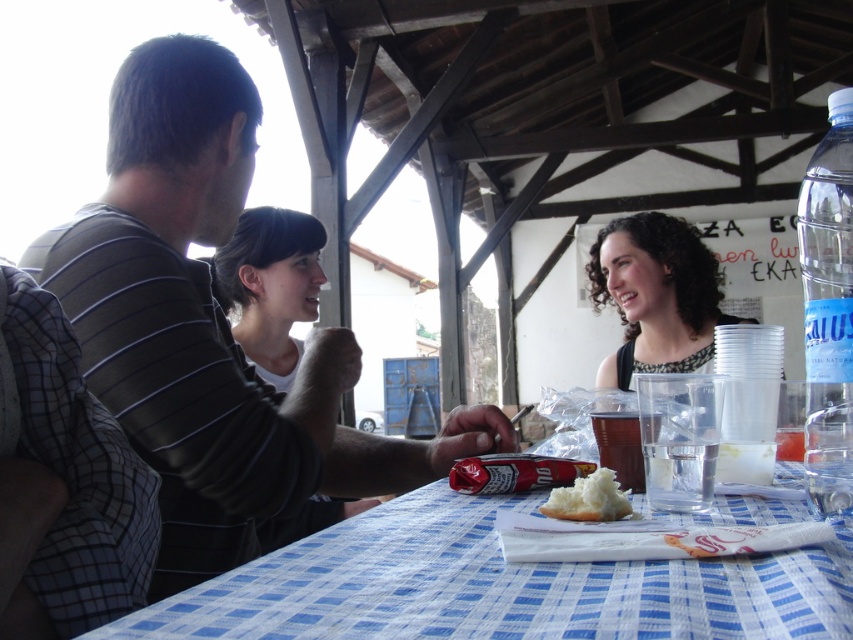
Between point (227, 259) and point (674, 465), which one is positioned in front?

Positioned in front is point (674, 465).

Which is behind, point (257, 349) or point (675, 468)?

Positioned behind is point (257, 349).

Where is `matte black hair at center`? matte black hair at center is located at coordinates (270, 285).

Does point (358, 355) come in front of point (618, 428)?

No, it is not.

Is striped cotton shirt at left wider than translucent plastic cup at table center?

Yes, striped cotton shirt at left is wider than translucent plastic cup at table center.

Who is more distant from viewer, (291, 428) or (595, 413)?

The point (595, 413) is behind.

Where is `striped cotton shirt at left`? striped cotton shirt at left is located at coordinates (210, 326).

Between blue checkered tablecloth at center and matte black hair at center, which one is positioned higher?

matte black hair at center is above.

Can you confirm if blue checkered tablecloth at center is wider than matte black hair at center?

Yes, blue checkered tablecloth at center is wider than matte black hair at center.

Is point (767, 628) positioned in front of point (289, 294)?

Yes, point (767, 628) is closer to viewer.

Locate an element on the screen. The image size is (853, 640). blue checkered tablecloth at center is located at coordinates (496, 586).